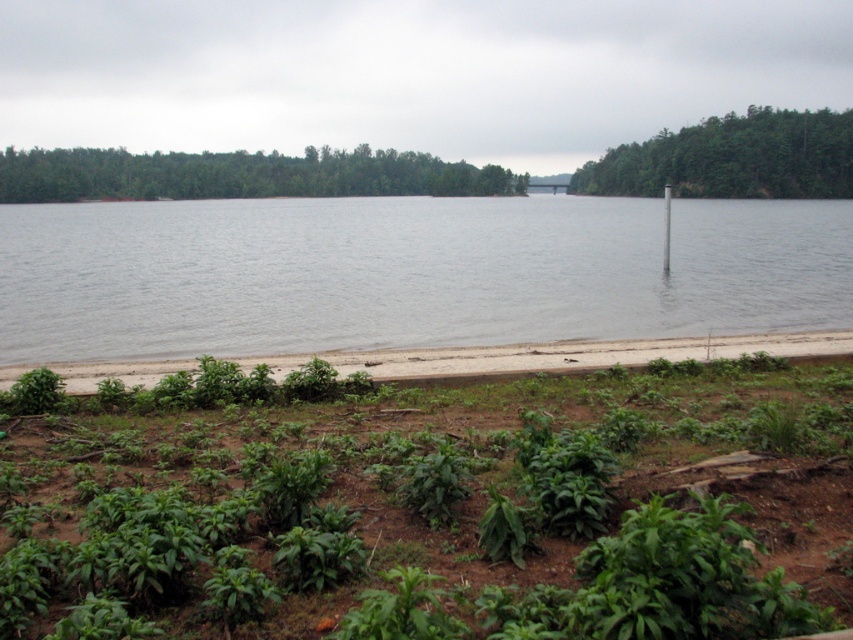
You are standing at the point marked by the coordinates point (x=577, y=355). Looking around, you see the sparse vegetation with small green plants and scattered brown soil. Can you describe what you observe at your current location?

The point (x=577, y=355) corresponds to the green grass at lower center, which is part of the sparse vegetation with small green plants and scattered brown soil described in the scene.

You are a gardener trying to determine which object in the scene has a narrower width. You see the green grass at lower center and the white plastic pole at center. Which one is thinner?

The green grass at lower center is thinner than the white plastic pole at center according to the description.